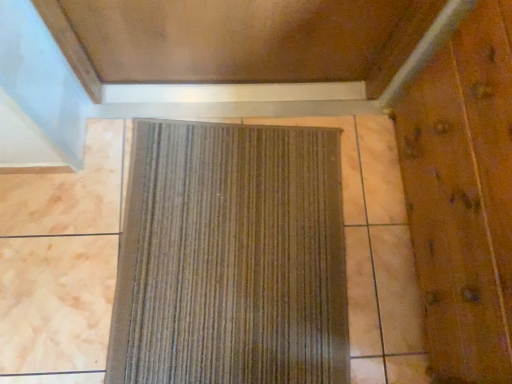
Question: Is brown textured mat at center outside of wooden elevator door at right?

Choices:
 (A) yes
 (B) no

Answer: (A)

Question: From the image's perspective, is brown textured mat at center over wooden elevator door at right?

Choices:
 (A) yes
 (B) no

Answer: (B)

Question: Considering the relative sizes of brown textured mat at center and wooden elevator door at right in the image provided, is brown textured mat at center smaller than wooden elevator door at right?

Choices:
 (A) no
 (B) yes

Answer: (B)

Question: From a real-world perspective, does brown textured mat at center stand above wooden elevator door at right?

Choices:
 (A) yes
 (B) no

Answer: (B)

Question: Can you confirm if brown textured mat at center is thinner than wooden elevator door at right?

Choices:
 (A) no
 (B) yes

Answer: (A)

Question: Does brown textured mat at center lie in front of wooden elevator door at right?

Choices:
 (A) no
 (B) yes

Answer: (A)

Question: Is wooden elevator door at right turned away from brown textured mat at center?

Choices:
 (A) yes
 (B) no

Answer: (B)

Question: Can you confirm if wooden elevator door at right is positioned to the left of brown textured mat at center?

Choices:
 (A) yes
 (B) no

Answer: (B)

Question: Does wooden elevator door at right have a lesser width compared to brown textured mat at center?

Choices:
 (A) no
 (B) yes

Answer: (B)

Question: Considering the relative sizes of wooden elevator door at right and brown textured mat at center in the image provided, is wooden elevator door at right taller than brown textured mat at center?

Choices:
 (A) no
 (B) yes

Answer: (B)

Question: Is wooden elevator door at right shorter than brown textured mat at center?

Choices:
 (A) yes
 (B) no

Answer: (B)

Question: Is wooden elevator door at right completely or partially outside of brown textured mat at center?

Choices:
 (A) yes
 (B) no

Answer: (A)

Question: Considering their positions, is brown textured mat at center located in front of or behind wooden elevator door at right?

Choices:
 (A) front
 (B) behind

Answer: (B)